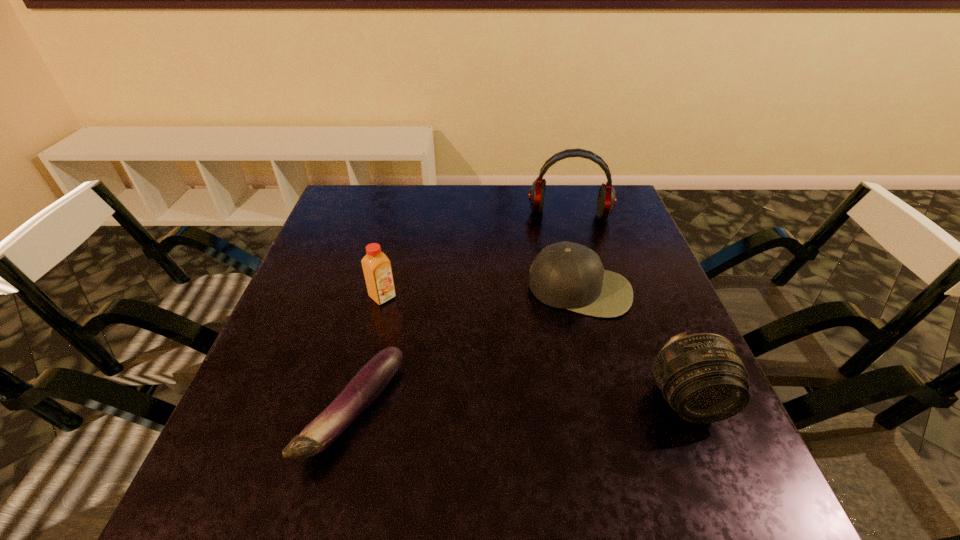
Where is `telephoto lens at the right edge`? Image resolution: width=960 pixels, height=540 pixels. telephoto lens at the right edge is located at coordinates (703, 377).

In order to click on earphone at the right edge in this screenshot , I will do `click(606, 201)`.

Locate an element on the screen. cap that is at the right edge is located at coordinates (566, 275).

I want to click on object located in the near left corner section of the desktop, so click(365, 386).

You are a GUI agent. You are given a task and a screenshot of the screen. Output one action in this format:
    pyautogui.click(x=<x>, y=<y>)
    Task: Click on the object present at the far right corner
    The width and height of the screenshot is (960, 540).
    Given the screenshot: What is the action you would take?
    pyautogui.click(x=606, y=201)

Locate an element on the screen. The height and width of the screenshot is (540, 960). object at the near right corner is located at coordinates (703, 377).

In the image, there is a desktop. Where is `vacant space at the far edge`? vacant space at the far edge is located at coordinates (386, 214).

This screenshot has width=960, height=540. In order to click on vacant space at the left edge of the desktop in this screenshot , I will do `click(306, 336)`.

The width and height of the screenshot is (960, 540). What are the coordinates of `vacant region at the right edge` in the screenshot? It's located at (642, 295).

In the image, there is a desktop. What are the coordinates of `vacant space at the far left corner` in the screenshot? It's located at (382, 200).